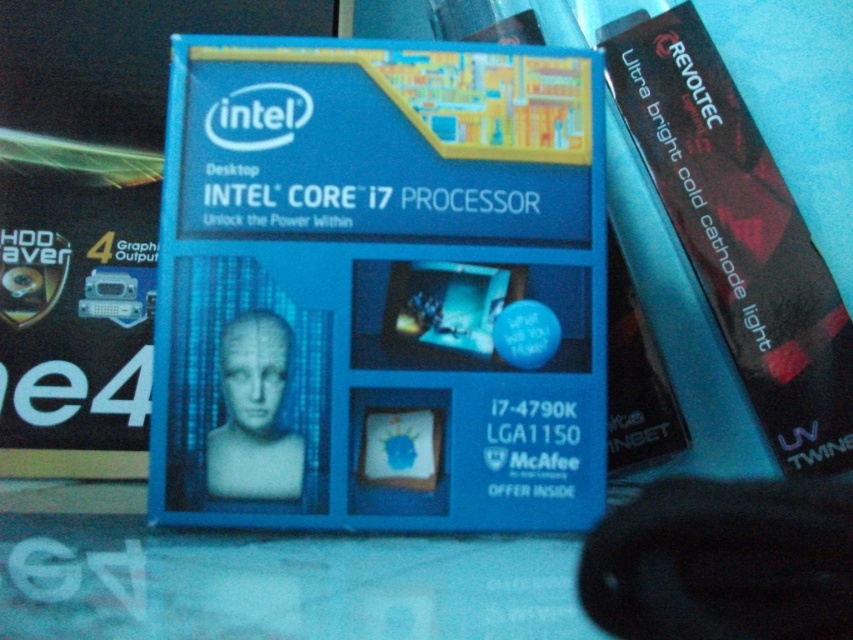
Does point (199, 401) come farther from viewer compared to point (764, 332)?

No, it is in front of (764, 332).

Is point (287, 196) positioned in front of point (636, 136)?

That is True.

Based on the photo, who is more distant from viewer, (485, 259) or (669, 36)?

Point (669, 36)

At what (x,y) coordinates should I click in order to perform the action: click on blue cardboard box at center. Please return your answer as a coordinate pair (x, y). Looking at the image, I should click on (380, 288).